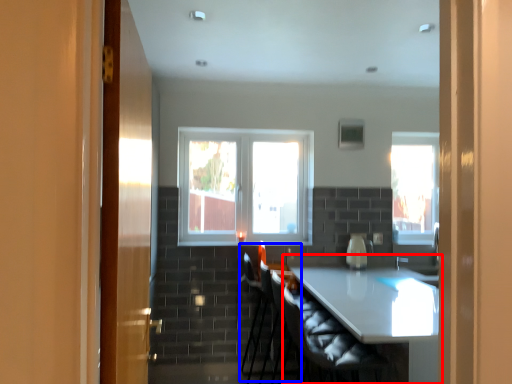
Question: Which point is closer to the camera, table (highlighted by a red box) or armchair (highlighted by a blue box)?

Choices:
 (A) table
 (B) armchair

Answer: (A)